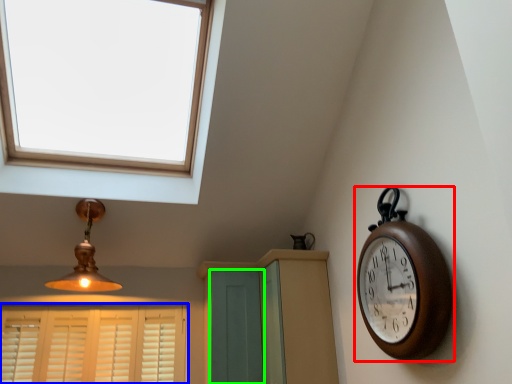
Question: Estimate the real-world distances between objects in this image. Which object is closer to wall clock (highlighted by a red box), window (highlighted by a blue box) or screen door (highlighted by a green box)?

Choices:
 (A) window
 (B) screen door

Answer: (B)